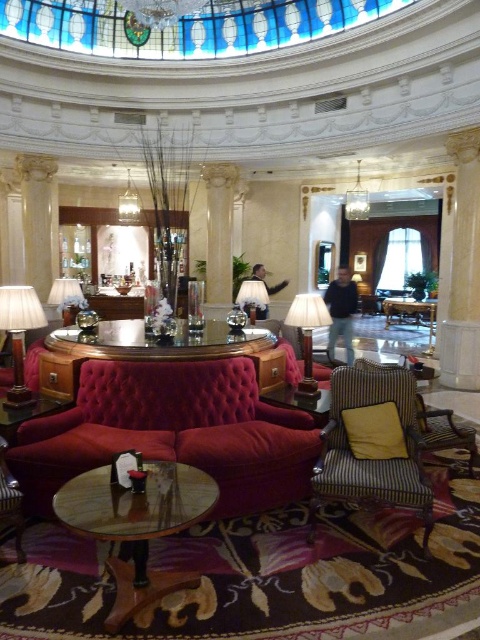
You are standing in the lobby and need to reach the striped fabric armchair at center. If your walking distance is limited to 3 meters, can you comfortably reach it without moving any furniture?

The striped fabric armchair at center is 2.94 meters away from you, so yes, you can comfortably reach it within your 3 meter limit without moving any furniture.